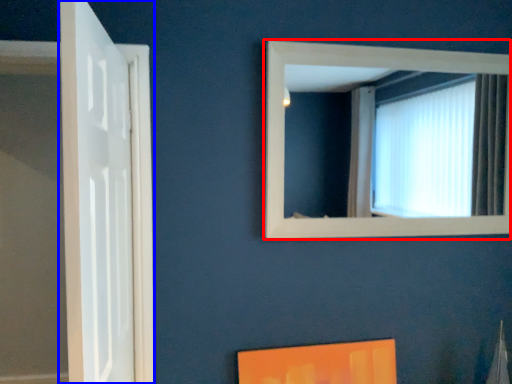
Question: Which point is further to the camera, window (highlighted by a red box) or door (highlighted by a blue box)?

Choices:
 (A) window
 (B) door

Answer: (A)